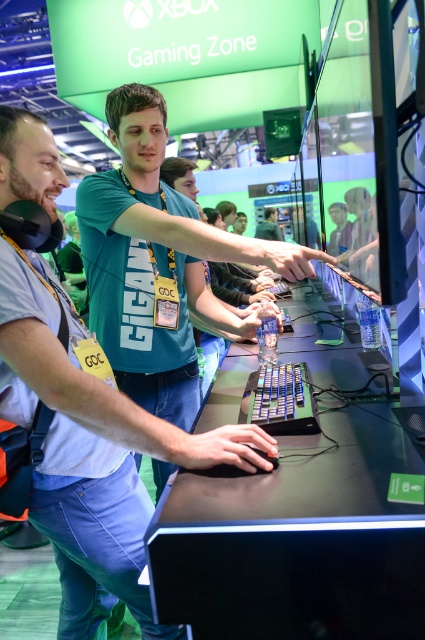
Where is `black plastic keyboard at center`? Image resolution: width=425 pixels, height=640 pixels. black plastic keyboard at center is located at coordinates (280, 400).

Measure the distance between point (x=289, y=362) and camera.

Point (x=289, y=362) and camera are 5.90 feet apart from each other.

Where is `black plastic keyboard at center`? The height and width of the screenshot is (640, 425). black plastic keyboard at center is located at coordinates (280, 400).